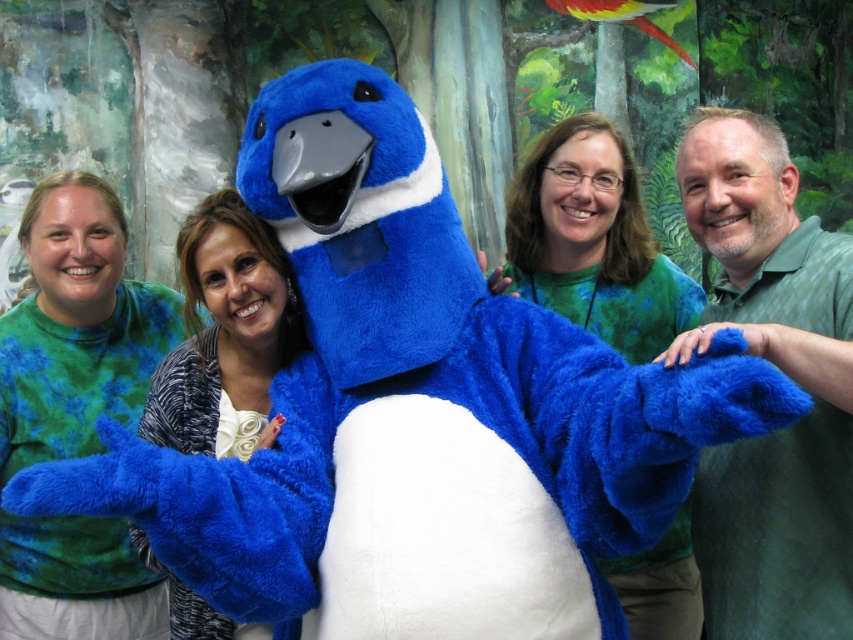
Is green textured shirt at right to the left of blue plush at center from the viewer's perspective?

No, green textured shirt at right is not to the left of blue plush at center.

Where is `green textured shirt at right`? The image size is (853, 640). green textured shirt at right is located at coordinates (782, 372).

Can you confirm if green textured shirt at right is taller than green tie-dye shirt at center?

No.

Does point (703, 188) come behind point (48, 353)?

No, it is not.

You are a GUI agent. You are given a task and a screenshot of the screen. Output one action in this format:
    pyautogui.click(x=<x>, y=<y>)
    Task: Click on the green textured shirt at right
    The width and height of the screenshot is (853, 640).
    Given the screenshot: What is the action you would take?
    pyautogui.click(x=782, y=372)

Find the location of a particular element. green textured shirt at right is located at coordinates (782, 372).

Measure the distance between green textured shirt at right and matte green shirt at center.

green textured shirt at right and matte green shirt at center are 31.54 inches apart.

Can you confirm if green textured shirt at right is shorter than matte green shirt at center?

Incorrect, green textured shirt at right's height does not fall short of matte green shirt at center's.

Is point (747, 609) positioned before point (666, 346)?

Yes.

This screenshot has height=640, width=853. What are the coordinates of `green textured shirt at right` in the screenshot? It's located at coord(782,372).